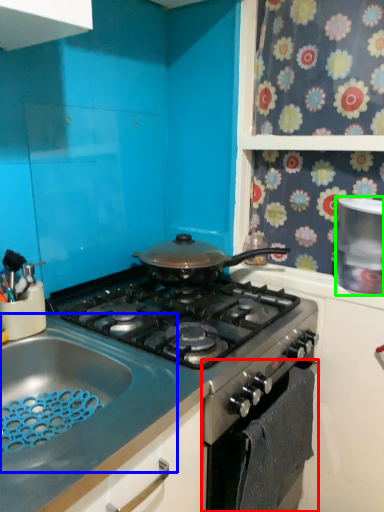
Question: Which object is positioned farthest from oven (highlighted by a red box)? Select from sink (highlighted by a blue box) and kitchen appliance (highlighted by a green box).

Choices:
 (A) sink
 (B) kitchen appliance

Answer: (B)